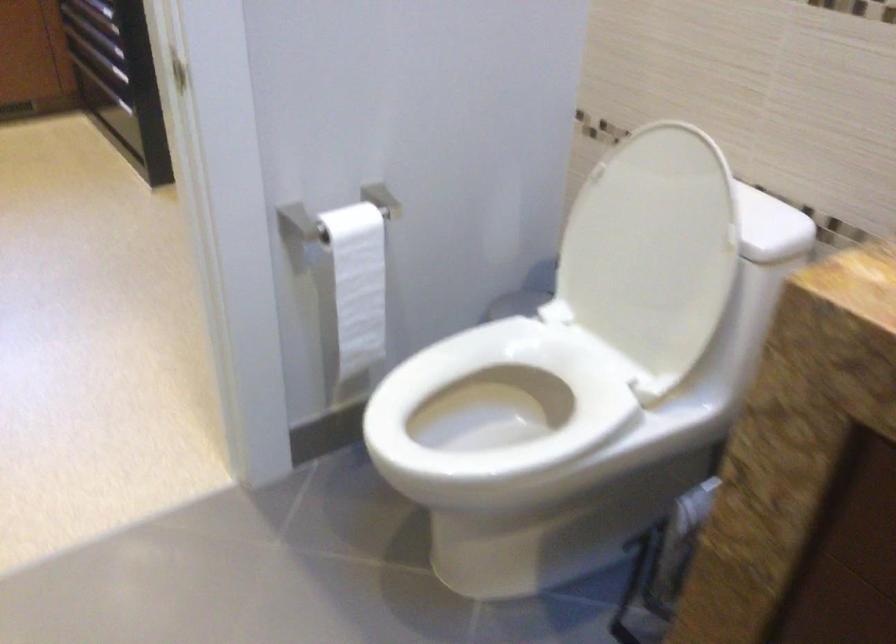
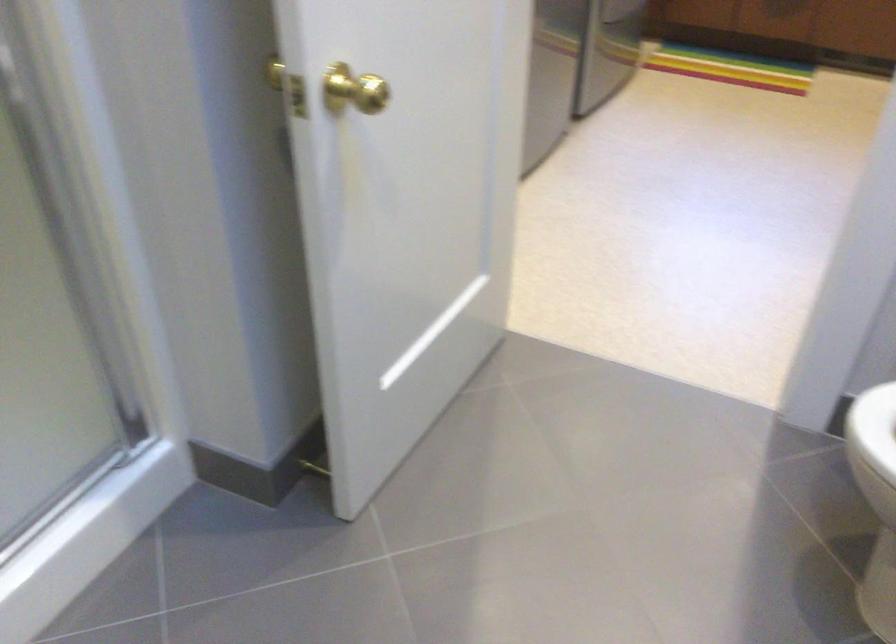
First-person continuous shooting, in which direction is the camera rotating?

The camera's rotation is toward left-down.